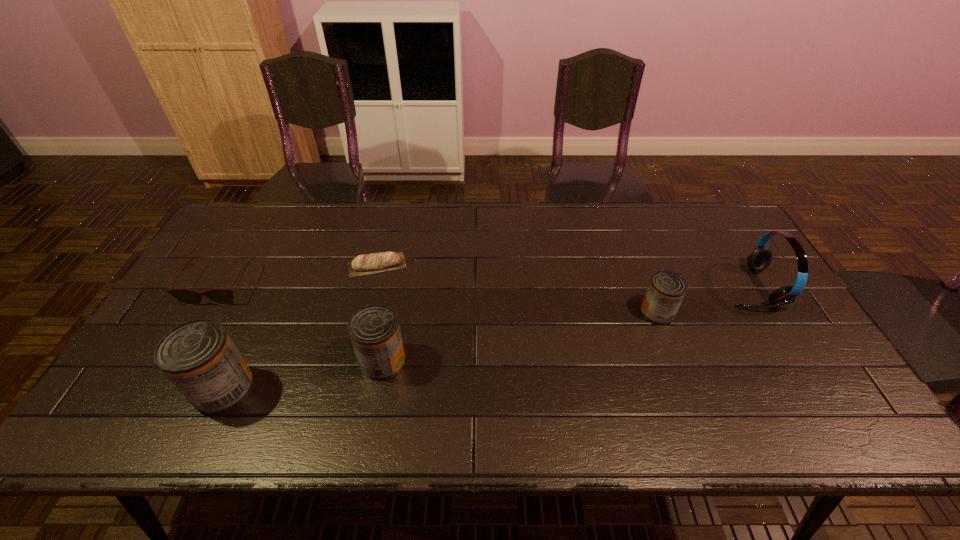
The width and height of the screenshot is (960, 540). What are the coordinates of `the leftmost can` in the screenshot? It's located at (200, 359).

This screenshot has height=540, width=960. Identify the location of the second can from right to left. (374, 330).

I want to click on the second tallest can, so click(x=374, y=330).

I want to click on the rightmost can, so click(x=667, y=289).

In order to click on the second object from right to left in this screenshot , I will do `click(667, 289)`.

At what (x,y) coordinates should I click in order to perform the action: click on headset. Please return your answer as a coordinate pair (x, y). Image resolution: width=960 pixels, height=540 pixels. Looking at the image, I should click on (760, 257).

This screenshot has width=960, height=540. Find the location of `pita bread`. pita bread is located at coordinates (372, 263).

This screenshot has width=960, height=540. I want to click on spectacles, so click(186, 296).

The height and width of the screenshot is (540, 960). Identify the location of free space located 0.260m on the back of the tallest can. (270, 289).

Locate an element on the screen. The height and width of the screenshot is (540, 960). vacant space located on the left of the second tallest can is located at coordinates (221, 361).